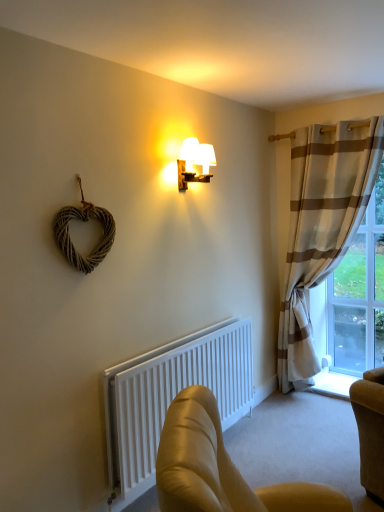
Question: Is white matte radiator at lower center at the back of leather armchair at lower center?

Choices:
 (A) yes
 (B) no

Answer: (B)

Question: Can white matte radiator at lower center be found inside leather armchair at lower center?

Choices:
 (A) no
 (B) yes

Answer: (A)

Question: Does leather armchair at lower center appear on the right side of white matte radiator at lower center?

Choices:
 (A) no
 (B) yes

Answer: (B)

Question: From the image's perspective, would you say leather armchair at lower center is positioned over white matte radiator at lower center?

Choices:
 (A) yes
 (B) no

Answer: (B)

Question: From a real-world perspective, is leather armchair at lower center located higher than white matte radiator at lower center?

Choices:
 (A) no
 (B) yes

Answer: (A)

Question: Does leather armchair at lower center have a larger size compared to white matte radiator at lower center?

Choices:
 (A) no
 (B) yes

Answer: (A)

Question: From the image's perspective, is leather armchair at lower center under woodenmaterial/texturelamp at upper center?

Choices:
 (A) yes
 (B) no

Answer: (A)

Question: Is the depth of leather armchair at lower center less than that of woodenmaterial/texturelamp at upper center?

Choices:
 (A) no
 (B) yes

Answer: (B)

Question: Would you say woodenmaterial/texturelamp at upper center is part of leather armchair at lower center's contents?

Choices:
 (A) no
 (B) yes

Answer: (A)

Question: From a real-world perspective, is leather armchair at lower center over woodenmaterial/texturelamp at upper center?

Choices:
 (A) yes
 (B) no

Answer: (B)

Question: Can you confirm if leather armchair at lower center is positioned to the right of woodenmaterial/texturelamp at upper center?

Choices:
 (A) no
 (B) yes

Answer: (B)

Question: Are leather armchair at lower center and woodenmaterial/texturelamp at upper center making contact?

Choices:
 (A) yes
 (B) no

Answer: (B)

Question: Can you confirm if clear glass window at right is smaller than leather armchair at lower center?

Choices:
 (A) yes
 (B) no

Answer: (A)